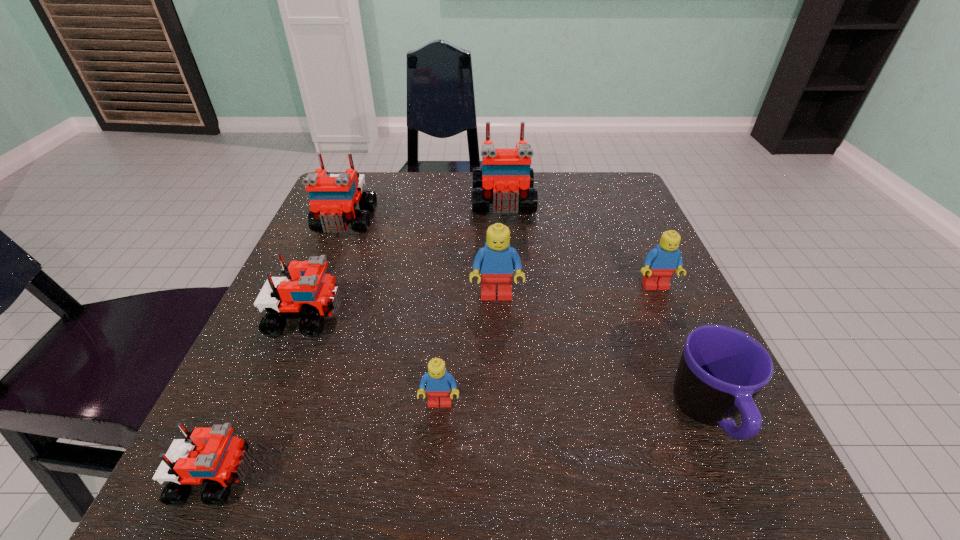
Locate an element on the screen. Image resolution: width=960 pixels, height=540 pixels. the smallest red Lego is located at coordinates (212, 455).

Locate an element on the screen. This screenshot has height=540, width=960. the nearest red Lego is located at coordinates (212, 455).

Find the location of `vacant position located on the front-facing side of the rightmost red Lego`. vacant position located on the front-facing side of the rightmost red Lego is located at coordinates (515, 354).

This screenshot has width=960, height=540. Identify the location of free point located on the front-facing side of the second biggest red Lego. (293, 352).

Locate an element on the screen. vacant space located 0.170m on the face of the biggest blue Lego is located at coordinates (500, 385).

At what (x,y) coordinates should I click in order to perform the action: click on blank space located 0.330m on the face of the rightmost blue Lego. Please return your answer as a coordinate pair (x, y). Image resolution: width=960 pixels, height=540 pixels. Looking at the image, I should click on (738, 472).

Where is `free region located on the front-facing side of the second nearest red Lego`? Image resolution: width=960 pixels, height=540 pixels. free region located on the front-facing side of the second nearest red Lego is located at coordinates (388, 317).

This screenshot has width=960, height=540. In order to click on free space located on the face of the fourth Lego from right to left in this screenshot , I will do `click(437, 445)`.

Where is `vacant area situated 0.280m on the front-facing side of the smallest red Lego`? This screenshot has width=960, height=540. vacant area situated 0.280m on the front-facing side of the smallest red Lego is located at coordinates pos(476,477).

The image size is (960, 540). Find the location of `mug present at the near edge`. mug present at the near edge is located at coordinates (721, 370).